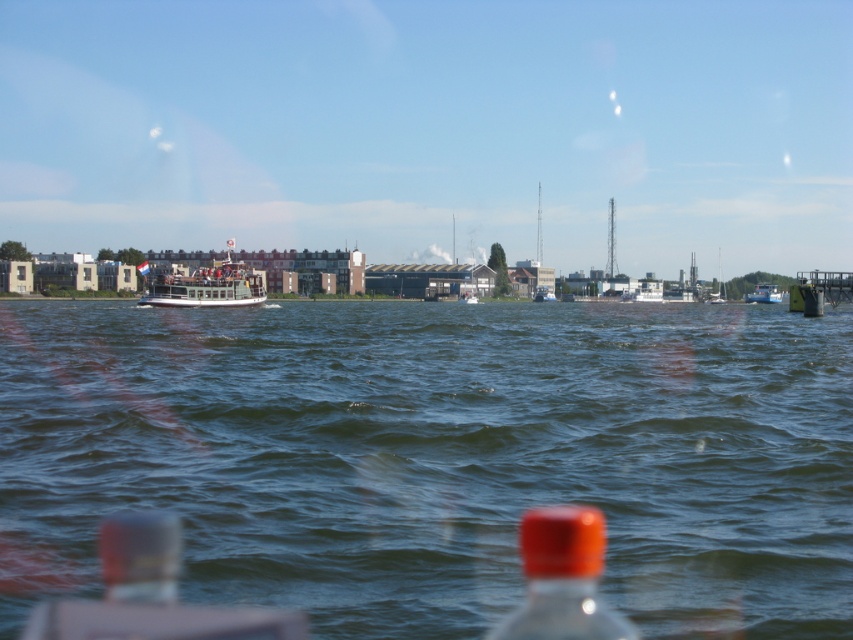
Is greenish-blue water at center smaller than white wooden ferry at center?

Yes.

Is greenish-blue water at center thinner than white wooden ferry at center?

Incorrect, greenish-blue water at center's width is not less than white wooden ferry at center's.

Is point (416, 573) closer to camera compared to point (184, 257)?

Yes, it is in front of point (184, 257).

Identify the location of greenish-blue water at center. (436, 456).

Is white wooden ferry at center shorter than blue matte boat at center?

In fact, white wooden ferry at center may be taller than blue matte boat at center.

Between white wooden ferry at center and blue matte boat at center, which one is positioned lower?

blue matte boat at center is lower down.

Is point (244, 296) more distant than point (770, 284)?

No, (244, 296) is in front of (770, 284).

Identify the location of white wooden ferry at center. The width and height of the screenshot is (853, 640). (202, 280).

Which of these two, greenish-blue water at center or blue matte boat at center, stands taller?

blue matte boat at center

Is greenish-blue water at center wider than blue matte boat at center?

Indeed, greenish-blue water at center has a greater width compared to blue matte boat at center.

The image size is (853, 640). I want to click on greenish-blue water at center, so click(436, 456).